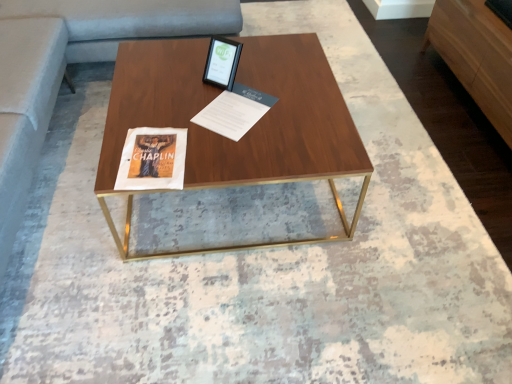
You are a GUI agent. You are given a task and a screenshot of the screen. Output one action in this format:
    pyautogui.click(x=<x>, y=<y>)
    Task: Click on the vacant area that is situated to the right of walnut wood coffee table at center
    The width and height of the screenshot is (512, 384).
    Given the screenshot: What is the action you would take?
    pyautogui.click(x=405, y=199)